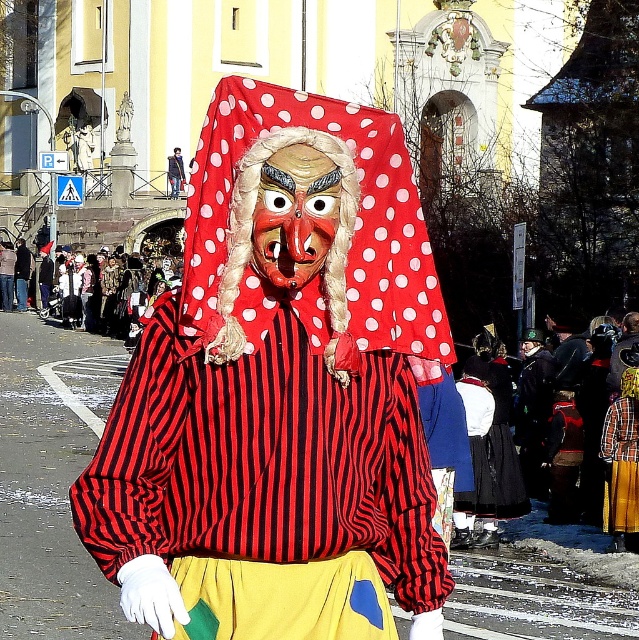
Question: Estimate the real-world distances between objects in this image. Which object is closer to the velvet red cape at center?

Choices:
 (A) red polka dot fabric at center
 (B) polished wood mask at center
 (C) matte red polka dot mask at center

Answer: (A)

Question: Is the position of matte red polka dot mask at center less distant than that of velvet red cape at center?

Choices:
 (A) no
 (B) yes

Answer: (B)

Question: Is matte red polka dot mask at center wider than polished wood mask at center?

Choices:
 (A) no
 (B) yes

Answer: (B)

Question: Is matte red polka dot mask at center closer to camera compared to velvet red cape at center?

Choices:
 (A) yes
 (B) no

Answer: (A)

Question: Which object appears closest to the camera in this image?

Choices:
 (A) polished wood mask at center
 (B) matte red polka dot mask at center
 (C) red polka dot fabric at center
 (D) velvet red cape at center

Answer: (B)

Question: Estimate the real-world distances between objects in this image. Which object is closer to the polished wood mask at center?

Choices:
 (A) velvet red cape at center
 (B) matte red polka dot mask at center

Answer: (B)